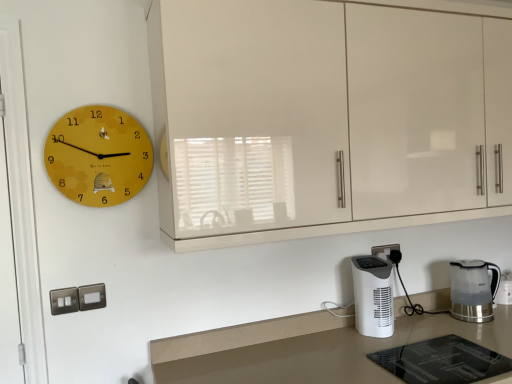
Question: Is transparent glass door at left positioned behind white plastic electric outlet at lower right?

Choices:
 (A) no
 (B) yes

Answer: (A)

Question: From the image's perspective, is transparent glass door at left below white plastic electric outlet at lower right?

Choices:
 (A) yes
 (B) no

Answer: (B)

Question: From the image's perspective, does transparent glass door at left appear higher than white plastic electric outlet at lower right?

Choices:
 (A) yes
 (B) no

Answer: (A)

Question: Is transparent glass door at left smaller than white plastic electric outlet at lower right?

Choices:
 (A) yes
 (B) no

Answer: (B)

Question: Is transparent glass door at left touching white plastic electric outlet at lower right?

Choices:
 (A) yes
 (B) no

Answer: (B)

Question: Considering the relative sizes of transparent glass door at left and white plastic electric outlet at lower right in the image provided, is transparent glass door at left bigger than white plastic electric outlet at lower right?

Choices:
 (A) yes
 (B) no

Answer: (A)

Question: Is transparent plastic kettle at lower right, acting as the second home appliance starting from the left, wider than white glossy countertop at lower center?

Choices:
 (A) yes
 (B) no

Answer: (B)

Question: Does transparent plastic kettle at lower right, acting as the second home appliance starting from the left, have a lesser width compared to white glossy countertop at lower center?

Choices:
 (A) no
 (B) yes

Answer: (B)

Question: Is transparent plastic kettle at lower right, acting as the first home appliance starting from the right, positioned in front of white glossy countertop at lower center?

Choices:
 (A) no
 (B) yes

Answer: (A)

Question: Considering the relative positions of transparent plastic kettle at lower right, acting as the first home appliance starting from the right, and white glossy countertop at lower center in the image provided, is transparent plastic kettle at lower right, acting as the first home appliance starting from the right, to the right of white glossy countertop at lower center from the viewer's perspective?

Choices:
 (A) no
 (B) yes

Answer: (B)

Question: Is transparent plastic kettle at lower right, acting as the first home appliance starting from the right, not near white glossy countertop at lower center?

Choices:
 (A) no
 (B) yes

Answer: (A)

Question: From a real-world perspective, does transparent plastic kettle at lower right, acting as the first home appliance starting from the right, stand above white glossy countertop at lower center?

Choices:
 (A) no
 (B) yes

Answer: (B)

Question: Can we say white plastic electric outlet at lower right lies outside yellow matte clock at upper left?

Choices:
 (A) no
 (B) yes

Answer: (B)